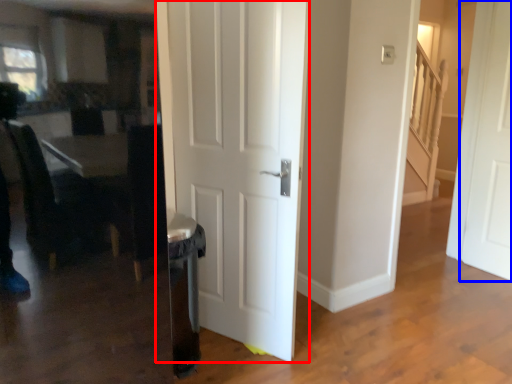
Question: Which point is further to the camera, door (highlighted by a red box) or door (highlighted by a blue box)?

Choices:
 (A) door
 (B) door

Answer: (B)